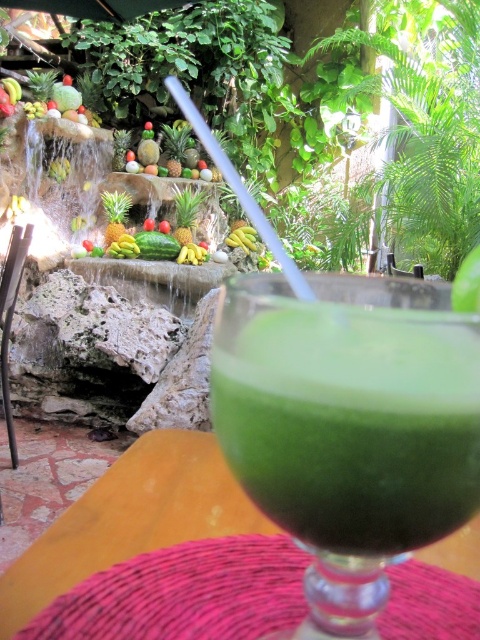
Is green frothy smoothie at center positioned behind yellow smooth bananas at center?

No.

Is green frothy smoothie at center in front of yellow smooth bananas at center?

Yes.

At what (x,y) coordinates should I click in order to perform the action: click on green frothy smoothie at center. Please return your answer as a coordinate pair (x, y). Image resolution: width=480 pixels, height=640 pixels. Looking at the image, I should click on click(x=352, y=422).

Is green matte pineapple at center bigger than yellow smooth banana at center?

Yes, green matte pineapple at center is bigger than yellow smooth banana at center.

Is green matte pineapple at center below yellow smooth banana at center?

No.

Is point (132, 157) behind point (255, 244)?

No, it is not.

Where is `green matte pineapple at center`? The image size is (480, 640). green matte pineapple at center is located at coordinates (169, 154).

Who is higher up, wooden table at center or green matte pineapple at center?

green matte pineapple at center is above.

Who is shorter, wooden table at center or green matte pineapple at center?

With less height is wooden table at center.

Who is more forward, (136,518) or (196,148)?

Point (136,518) is in front.

Identify the location of wooden table at center. pos(131,518).